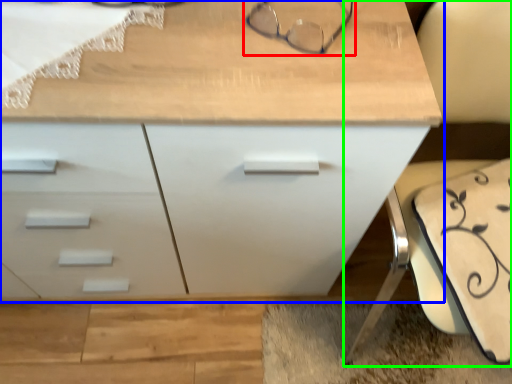
Question: Estimate the real-world distances between objects in this image. Which object is farther from glasses (highlighted by a red box), chest of drawers (highlighted by a blue box) or swivel chair (highlighted by a green box)?

Choices:
 (A) chest of drawers
 (B) swivel chair

Answer: (B)